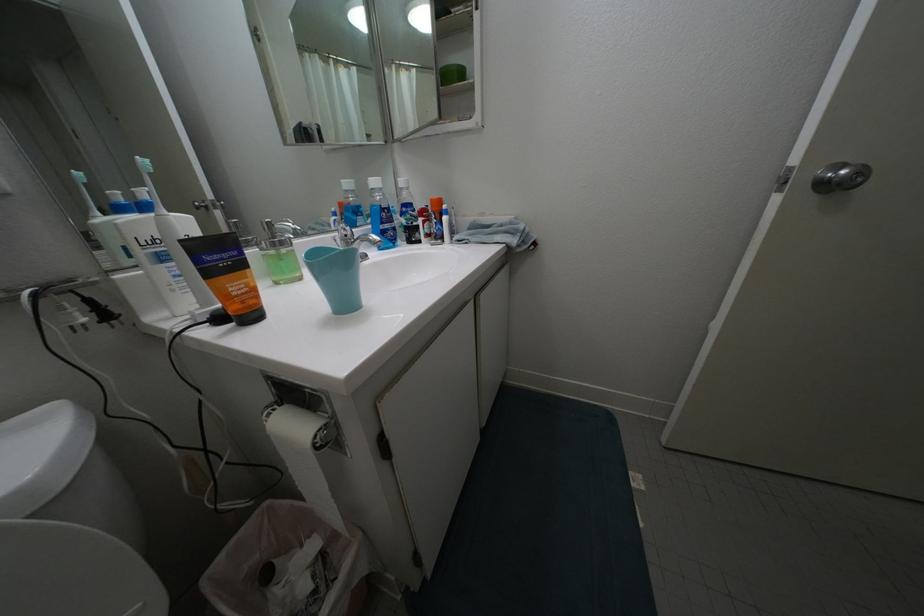
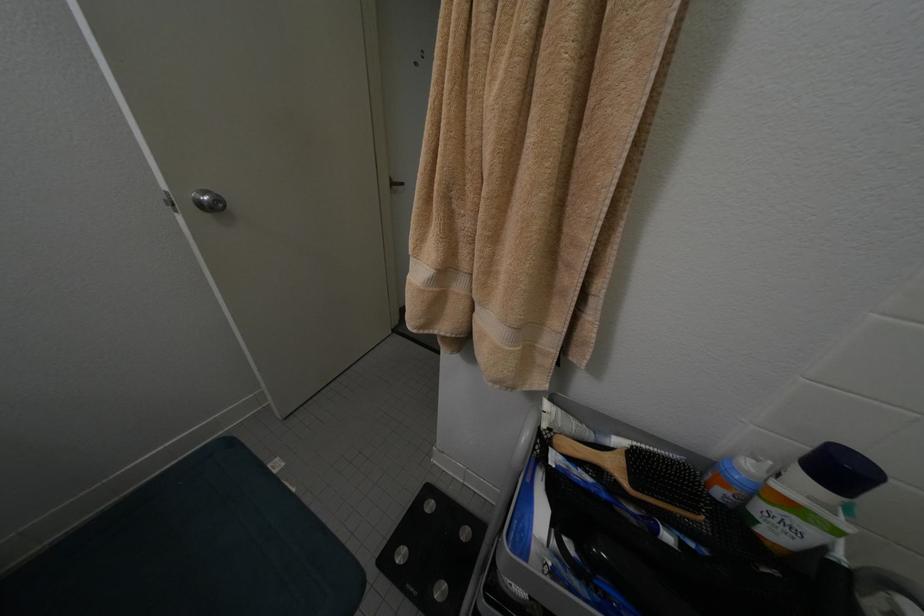
The images are taken continuously from a first-person perspective. In which direction is your viewpoint rotating?

The rotation direction of the camera is right-down.